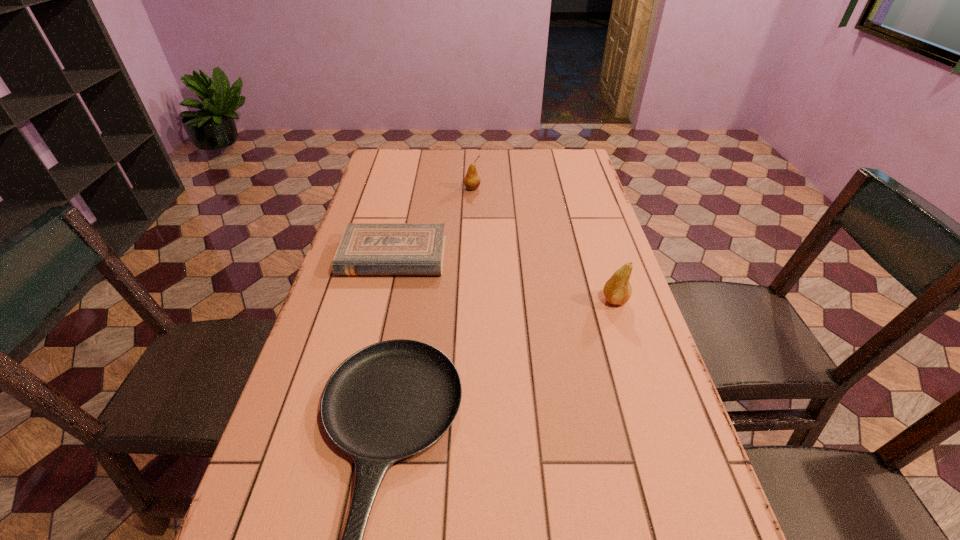
Locate an element on the screen. The image size is (960, 540). the farthest object is located at coordinates (472, 181).

You are a GUI agent. You are given a task and a screenshot of the screen. Output one action in this format:
    pyautogui.click(x=<x>, y=<y>)
    Task: Click on the left pear
    
    Given the screenshot: What is the action you would take?
    pyautogui.click(x=472, y=181)

The image size is (960, 540). What are the coordinates of `the right pear` in the screenshot? It's located at (x=617, y=290).

Identify the location of the third farthest object. (617, 290).

Identify the location of the third nearest object. (365, 248).

Identify the location of the second shortest object. (365, 248).

I want to click on free point located 0.170m on the front of the left pear, so click(x=471, y=221).

The image size is (960, 540). What are the coordinates of `free spot located on the front of the nearer pear` in the screenshot? It's located at (629, 344).

The image size is (960, 540). Find the location of `free space located 0.090m on the spine side of the third tallest object`. free space located 0.090m on the spine side of the third tallest object is located at coordinates (382, 302).

At what (x,y) coordinates should I click in order to perform the action: click on object that is positioned at the left edge. Please return your answer as a coordinate pair (x, y). This screenshot has height=540, width=960. Looking at the image, I should click on (365, 248).